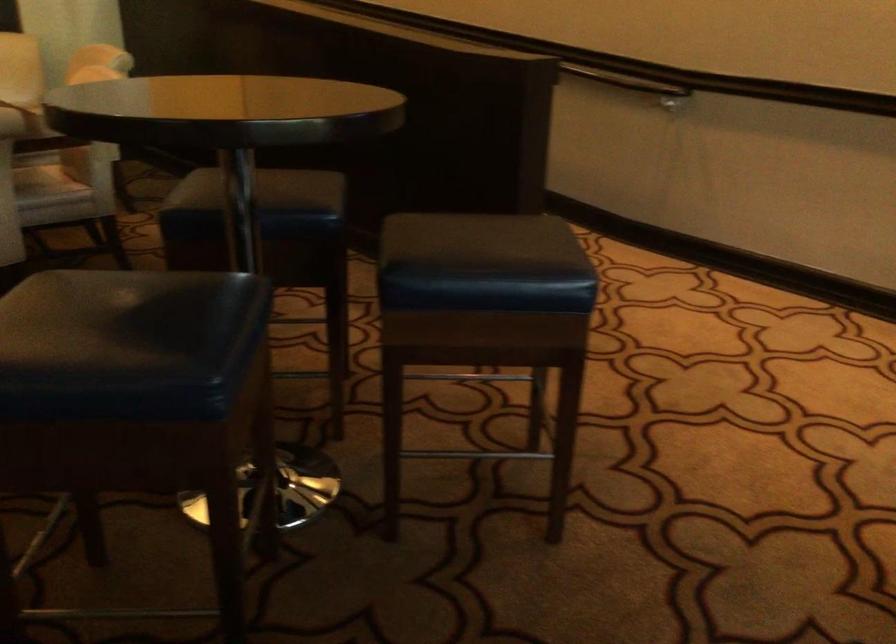
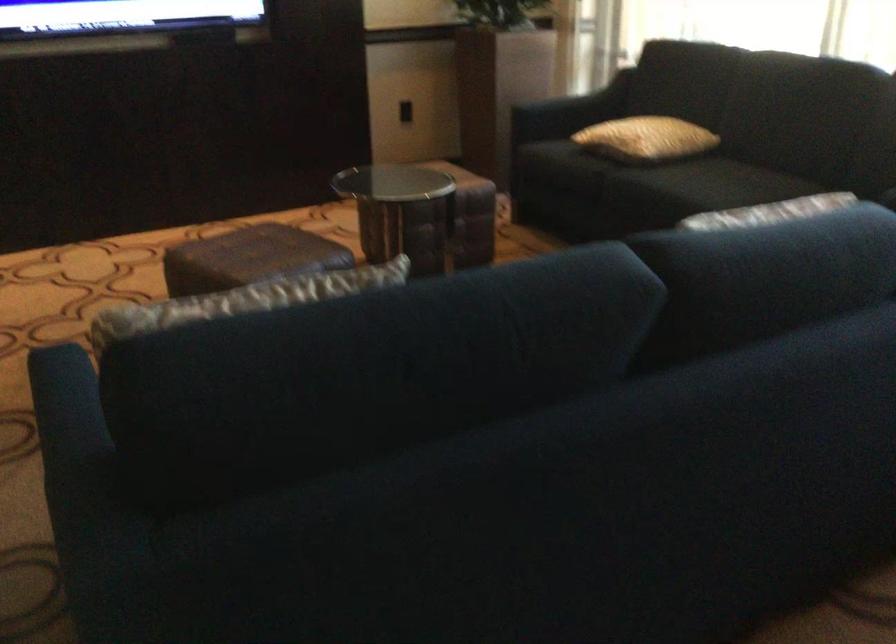
The images are taken continuously from a first-person perspective. In which direction is your viewpoint rotating?

The camera's rotation is toward right-down.